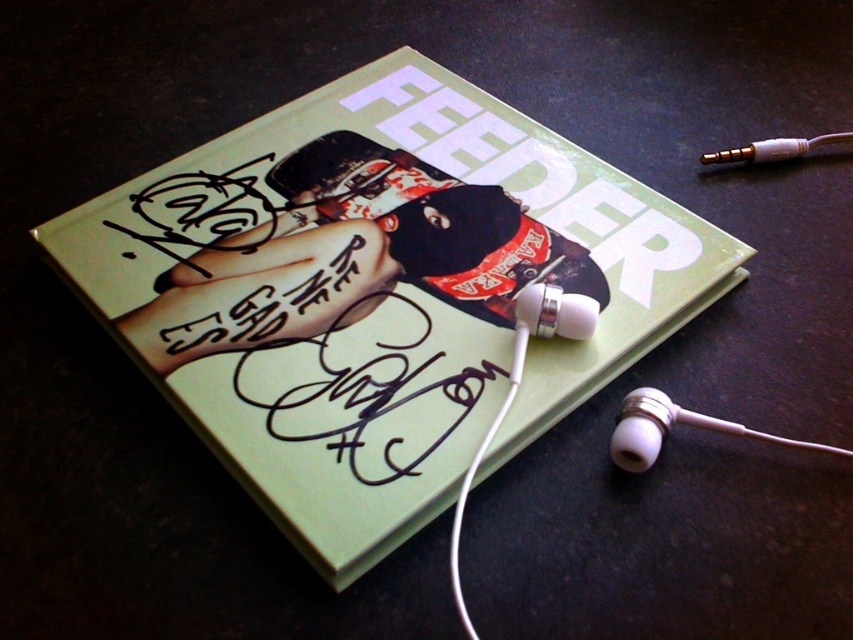
You are a delivery person who needs to pack the green matte book at center and the white plastic earbud at bottom right into a box. The box has a height limit of 10 cm. Can both items fit vertically in the box?

The green matte book at center has a greater height compared to white plastic earbud at bottom right. Since the box has a height limit of 10 cm, you need to ensure that the tallest item, the green matte book at center, is within this limit. If the book is under 10 cm, both can fit. However, without the exact height measurements, it is impossible to confirm.

You are a delivery person who needs to place a package on the green matte book at center without touching the white plastic earbud at bottom right. Can you do it?

The green matte book at center is 16.28 inches away from the white plastic earbud at bottom right. Since the distance is sufficient, you can place the package on the green matte book at center without touching the earbud.

You are looking at the vinyl record cover and notice two points marked on it. According to their positions, which point is closer to you, point [483,266] or point [625,404]?

Point [625,404] is closer to you because point [483,266] is behind it.